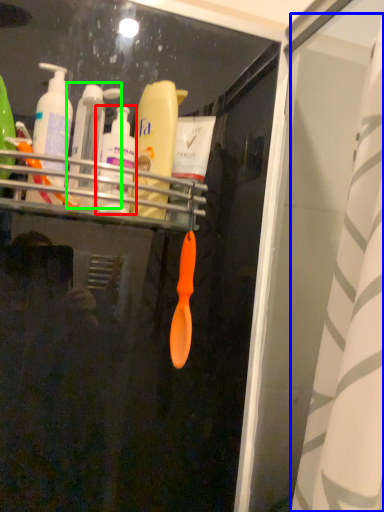
Question: Which object is the closest to the toiletry (highlighted by a red box)? Choose among these: shower curtain (highlighted by a blue box) or toiletry (highlighted by a green box).

Choices:
 (A) shower curtain
 (B) toiletry

Answer: (B)